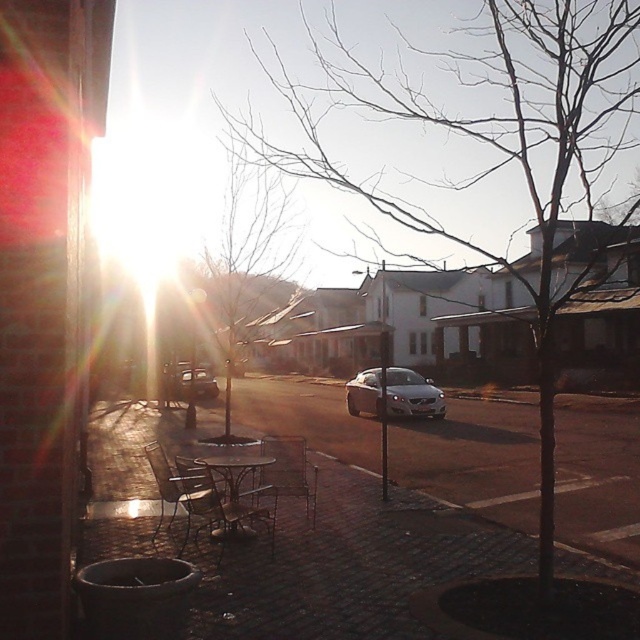
What do you see at coordinates (240, 493) in the screenshot? I see `metallic silver table at center` at bounding box center [240, 493].

Is point (253, 532) positioned after point (314, 490)?

No.

Which is behind, point (260, 460) or point (276, 493)?

The point (276, 493) is behind.

At what (x,y) coordinates should I click in order to perform the action: click on metallic silver table at center. Please return your answer as a coordinate pair (x, y). Looking at the image, I should click on (240, 493).

Is metallic silver table at center above metallic silver chair at lower left?

Incorrect, metallic silver table at center is not positioned above metallic silver chair at lower left.

Is point (252, 518) less distant than point (209, 524)?

No.

At what (x,y) coordinates should I click in order to perform the action: click on metallic silver table at center. Please return your answer as a coordinate pair (x, y). This screenshot has height=640, width=640. Looking at the image, I should click on (240, 493).

Can you confirm if satin silver sedan at center is bigger than metallic silver chair at center?

Indeed, satin silver sedan at center has a larger size compared to metallic silver chair at center.

Can you confirm if satin silver sedan at center is positioned below metallic silver chair at center?

Incorrect, satin silver sedan at center is not positioned below metallic silver chair at center.

Where is `satin silver sedan at center`? The height and width of the screenshot is (640, 640). satin silver sedan at center is located at coordinates (412, 394).